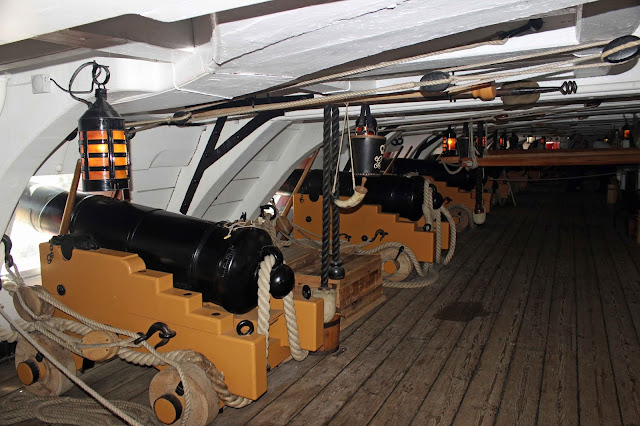
Where is `wooden box`? wooden box is located at coordinates (356, 283), (292, 256).